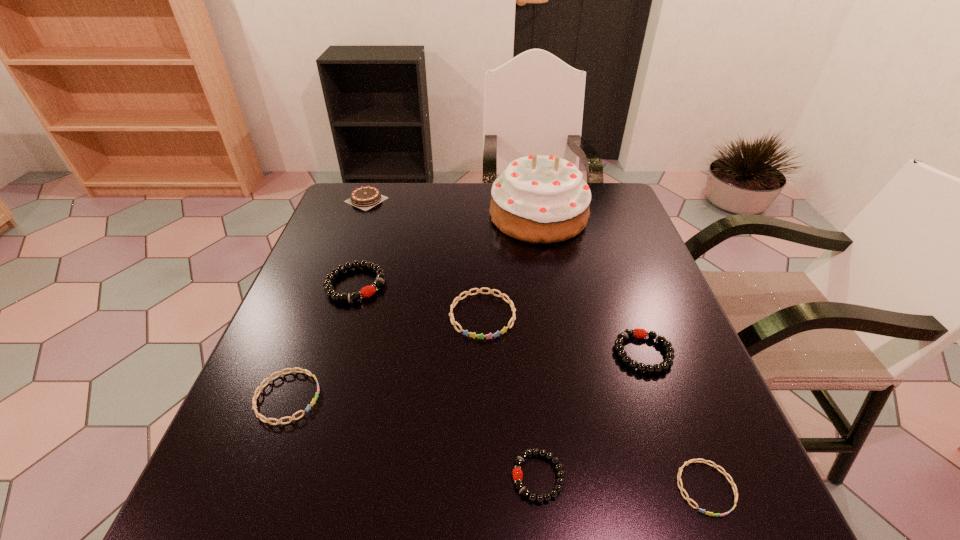
In order to click on the second closest bracelet to the brown chocolate cake in this screenshot , I will do [x=480, y=336].

Find the location of a particular element. black bracelet that stands as the second closest to the brown chocolate cake is located at coordinates (637, 333).

Identify which black bracelet is the second closest to the rightmost black bracelet. Please provide its 2D coordinates. Your answer should be formatted as a tuple, i.e. [(x, y)], where the tuple contains the x and y coordinates of a point satisfying the conditions above.

[(367, 291)]

Identify the location of blue bracelet that can be found as the third closest to the red cake. The height and width of the screenshot is (540, 960). (687, 498).

The image size is (960, 540). Identify the location of blue bracelet that is the closest to the smallest blue bracelet. (480, 336).

The width and height of the screenshot is (960, 540). I want to click on free region that satisfies the following two spatial constraints: 1. on the front side of the red cake; 2. on the surface of the second farthest blue bracelet showing star-shaped elements, so click(x=571, y=397).

This screenshot has width=960, height=540. Identify the location of vacant space that satisfies the following two spatial constraints: 1. on the surface of the second black bracelet from right to left showing star-shaped elements; 2. on the left side of the leftmost blue bracelet. (257, 477).

This screenshot has height=540, width=960. Identify the location of vacant space that satisfies the following two spatial constraints: 1. on the surface of the second biggest blue bracelet showing star-shaped elements; 2. on the back side of the nearest black bracelet. (257, 477).